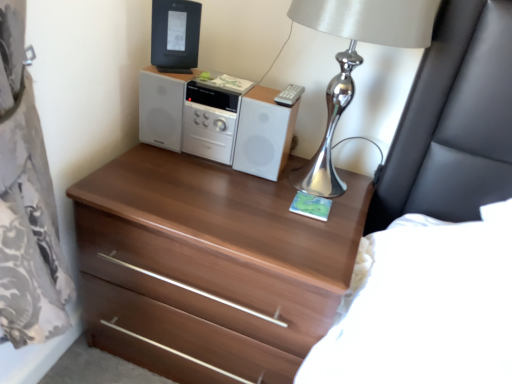
This screenshot has width=512, height=384. Find the location of `free space underneath silver metallic table lamp at upper right (from a real-world perspective)`. free space underneath silver metallic table lamp at upper right (from a real-world perspective) is located at coordinates (331, 200).